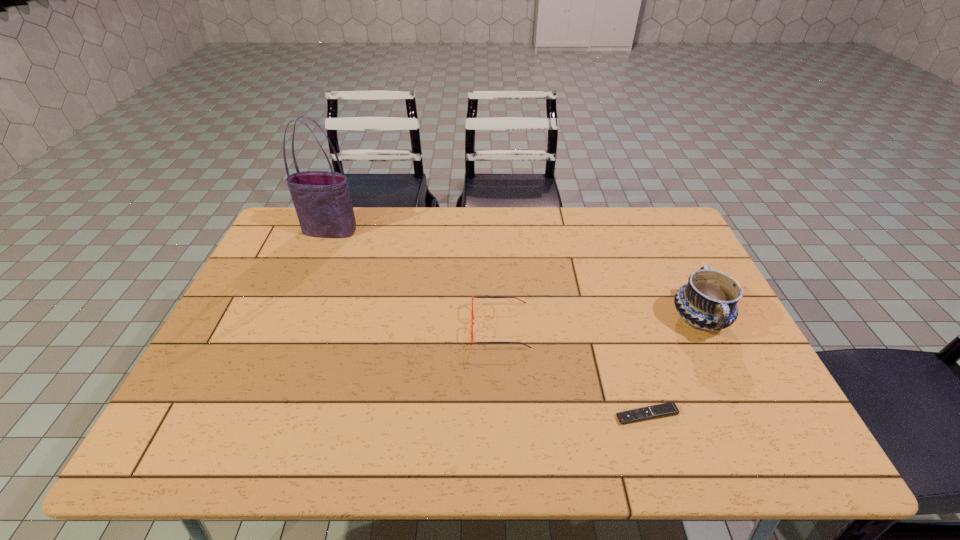
Where is `the leftmost object`? The image size is (960, 540). the leftmost object is located at coordinates (322, 200).

This screenshot has height=540, width=960. Identify the location of the farthest object. (322, 200).

The image size is (960, 540). I want to click on pottery, so click(708, 301).

Locate an element on the screen. Image resolution: width=960 pixels, height=540 pixels. the second tallest object is located at coordinates (708, 301).

Where is `the third tallest object`? The width and height of the screenshot is (960, 540). the third tallest object is located at coordinates (472, 318).

Where is `spectacles`? The image size is (960, 540). spectacles is located at coordinates 472,318.

I want to click on the third object from left to right, so click(x=666, y=409).

You are a GUI agent. You are given a task and a screenshot of the screen. Output one action in this format:
    pyautogui.click(x=<x>, y=<y>)
    Task: Click on the remote control
    This screenshot has height=540, width=960.
    Given the screenshot: What is the action you would take?
    pyautogui.click(x=666, y=409)

Where is `vacant region located 0.400m on the right of the farthest object`? The image size is (960, 540). vacant region located 0.400m on the right of the farthest object is located at coordinates (476, 231).

Locate an element on the screen. This screenshot has width=960, height=540. free space located 0.190m on the front of the rightmost object is located at coordinates (744, 413).